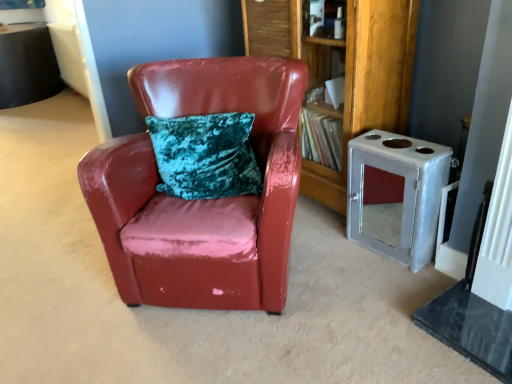
Question: Considering the relative sizes of wooden bookshelf at center and glossy leather chair at center in the image provided, is wooden bookshelf at center shorter than glossy leather chair at center?

Choices:
 (A) no
 (B) yes

Answer: (A)

Question: Is wooden bookshelf at center located outside glossy leather chair at center?

Choices:
 (A) yes
 (B) no

Answer: (A)

Question: Is wooden bookshelf at center positioned far away from glossy leather chair at center?

Choices:
 (A) yes
 (B) no

Answer: (B)

Question: From the image's perspective, is wooden bookshelf at center over glossy leather chair at center?

Choices:
 (A) yes
 (B) no

Answer: (A)

Question: Is wooden bookshelf at center touching glossy leather chair at center?

Choices:
 (A) no
 (B) yes

Answer: (A)

Question: From the image's perspective, relative to wooden bookshelf at center, is glossy leather chair at center above or below?

Choices:
 (A) below
 (B) above

Answer: (A)

Question: From a real-world perspective, relative to wooden bookshelf at center, is glossy leather chair at center vertically above or below?

Choices:
 (A) above
 (B) below

Answer: (B)

Question: Is glossy leather chair at center to the left or to the right of wooden bookshelf at center in the image?

Choices:
 (A) left
 (B) right

Answer: (A)

Question: Is glossy leather chair at center taller or shorter than wooden bookshelf at center?

Choices:
 (A) short
 (B) tall

Answer: (A)

Question: In the image, is metallic silver cabinet at right on the left side or the right side of wooden bookshelf at center?

Choices:
 (A) right
 (B) left

Answer: (A)

Question: Is metallic silver cabinet at right in front of or behind wooden bookshelf at center in the image?

Choices:
 (A) behind
 (B) front

Answer: (B)

Question: From a real-world perspective, is metallic silver cabinet at right above or below wooden bookshelf at center?

Choices:
 (A) above
 (B) below

Answer: (B)

Question: From the image's perspective, relative to wooden bookshelf at center, is metallic silver cabinet at right above or below?

Choices:
 (A) above
 (B) below

Answer: (B)

Question: Is glossy leather chair at center wider or thinner than metallic silver cabinet at right?

Choices:
 (A) thin
 (B) wide

Answer: (B)

Question: Is glossy leather chair at center taller or shorter than metallic silver cabinet at right?

Choices:
 (A) short
 (B) tall

Answer: (B)